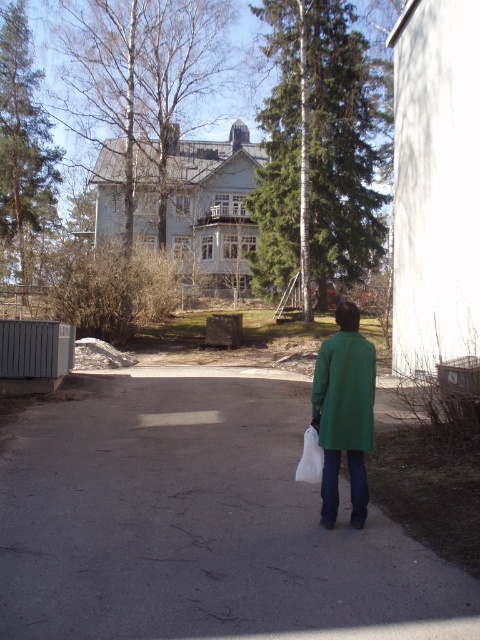
Question: Which point is farther from the camera taking this photo?

Choices:
 (A) (354, 412)
 (B) (78, 474)

Answer: (B)

Question: Which object appears closest to the camera in this image?

Choices:
 (A) green matte jacket at lower center
 (B) gray asphalt pavement at center

Answer: (B)

Question: Observing the image, what is the correct spatial positioning of gray asphalt pavement at center in reference to green matte jacket at lower center?

Choices:
 (A) below
 (B) above

Answer: (A)

Question: Is gray asphalt pavement at center to the right of green matte jacket at lower center from the viewer's perspective?

Choices:
 (A) yes
 (B) no

Answer: (B)

Question: Which point is closer to the camera?

Choices:
 (A) (278, 468)
 (B) (342, 419)

Answer: (B)

Question: Can you confirm if gray asphalt pavement at center is thinner than green matte jacket at lower center?

Choices:
 (A) no
 (B) yes

Answer: (A)